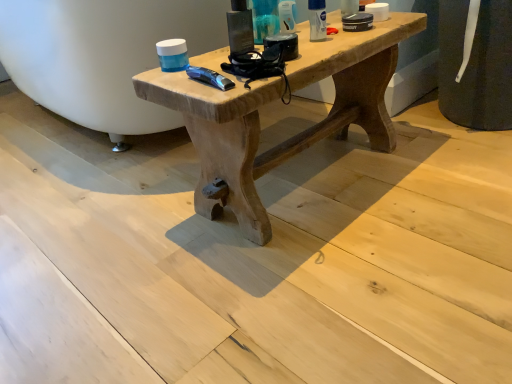
At what (x,y) coordinates should I click in order to perform the action: click on free point in front of translucent plastic tube at upper center, the second toiletry in the right-to-left sequence. Please return your answer as a coordinate pair (x, y). This screenshot has width=512, height=384. Looking at the image, I should click on pyautogui.click(x=321, y=42).